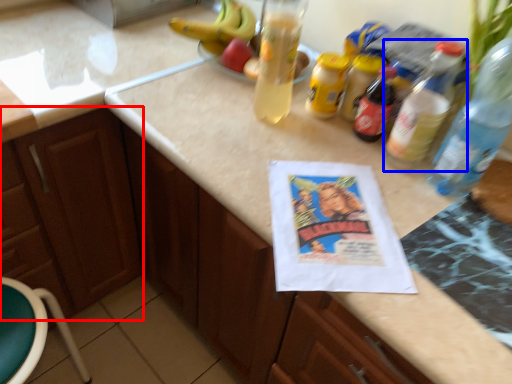
Question: Which object is further to the camera taking this photo, cabinetry (highlighted by a red box) or bottle (highlighted by a blue box)?

Choices:
 (A) cabinetry
 (B) bottle

Answer: (A)